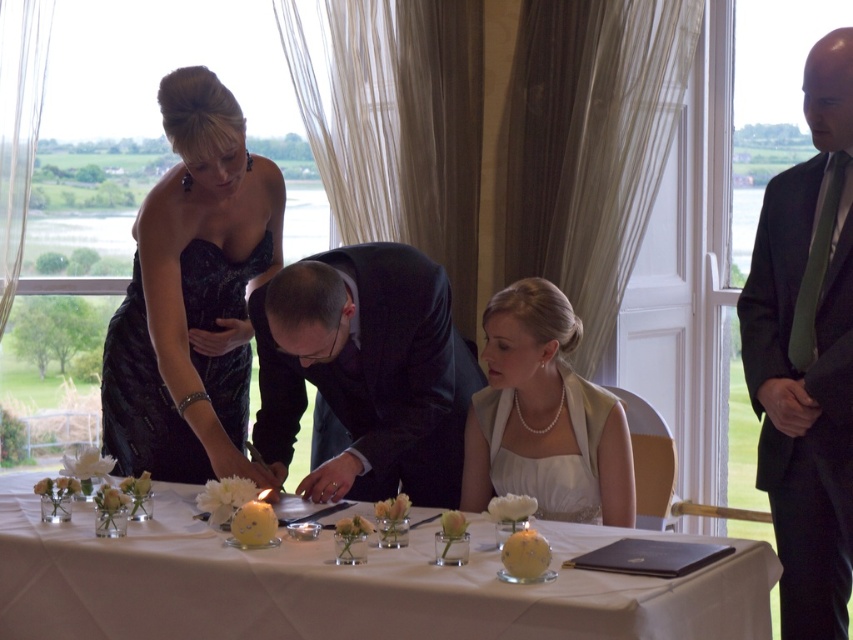
You are a photographer at the event and need to capture a closeup of the pearl necklace at center without the black satin dress at upper left blocking the view. Is this possible given their sizes?

The black satin dress at upper left is wider than the pearl necklace at center, so it might block the necklace if positioned closely. Adjust the angle or distance to ensure the necklace is fully visible without the dress obstructing it.

You are a guest at the event and want to move from your seat to the dark suit at right. Is the white glass table at center blocking your path?

A: The white glass table at center is in front of the dark suit at right, so it is blocking the path to the dark suit at right.